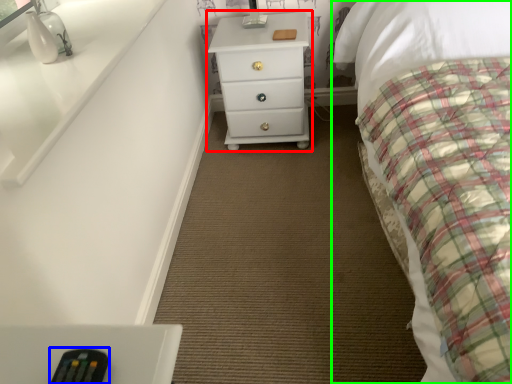
Question: Based on their relative distances, which object is farther from chest of drawers (highlighted by a red box)? Choose from remote (highlighted by a blue box) and bed (highlighted by a green box).

Choices:
 (A) remote
 (B) bed

Answer: (A)